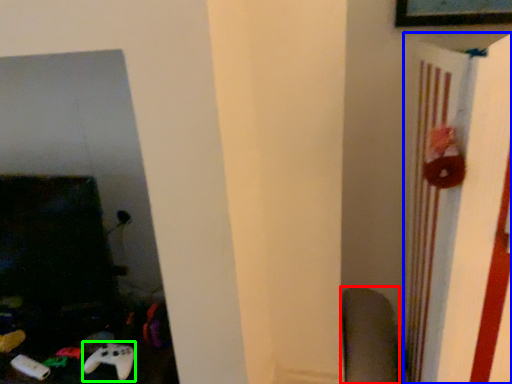
Question: Estimate the real-world distances between objects in this image. Which object is closer to swivel chair (highlighted by a red box), bulletin board (highlighted by a blue box) or game controller (highlighted by a green box)?

Choices:
 (A) bulletin board
 (B) game controller

Answer: (A)